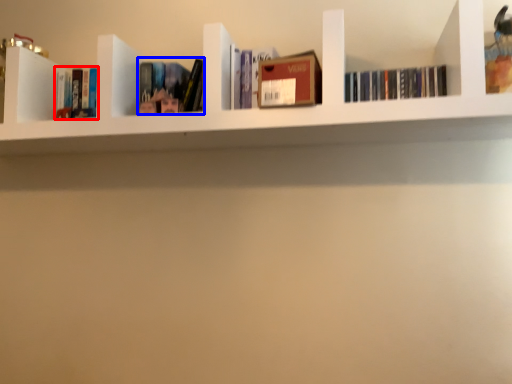
Question: Among these objects, which one is farthest to the camera, book (highlighted by a red box) or book (highlighted by a blue box)?

Choices:
 (A) book
 (B) book

Answer: (A)